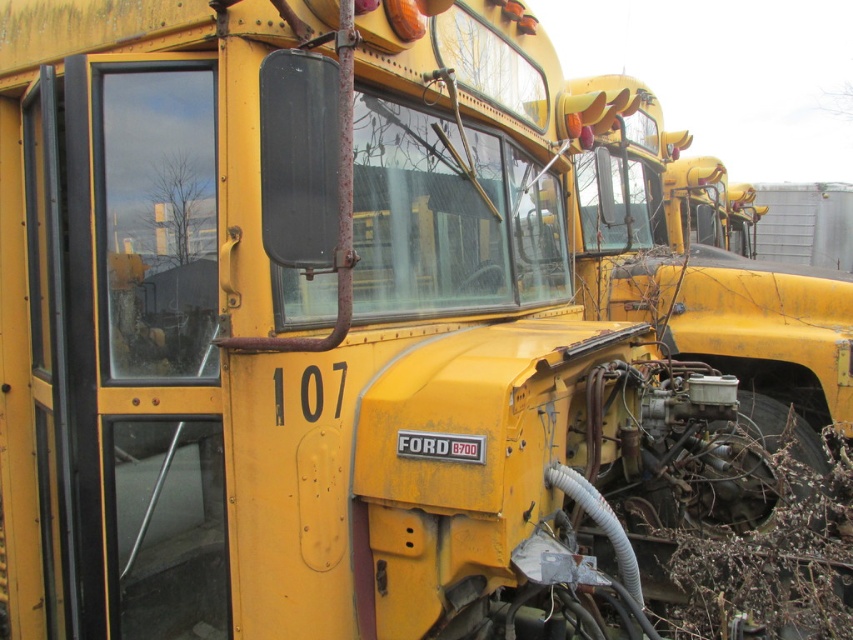
Question: Observing the image, what is the correct spatial positioning of brown fibrous weed at lower right in reference to yellow matte license plate at center?

Choices:
 (A) below
 (B) above

Answer: (A)

Question: Does brown fibrous weed at lower right appear under yellow matte license plate at center?

Choices:
 (A) yes
 (B) no

Answer: (A)

Question: Which point is farther to the camera?

Choices:
 (A) (712, 529)
 (B) (405, 436)

Answer: (A)

Question: Can you confirm if brown fibrous weed at lower right is positioned below yellow matte license plate at center?

Choices:
 (A) yes
 (B) no

Answer: (A)

Question: Which of the following is the closest to the observer?

Choices:
 (A) brown fibrous weed at lower right
 (B) yellow matte license plate at center

Answer: (B)